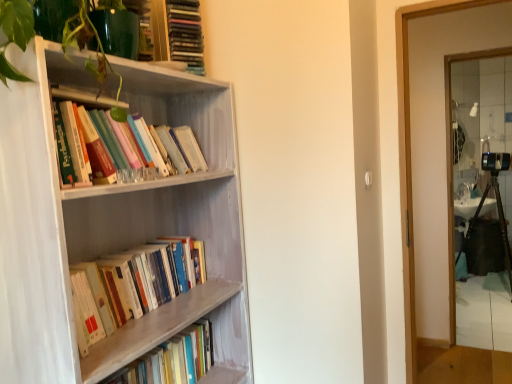
Question: Does wooden bookcase at left have a lesser height compared to clear glass mirror at right?

Choices:
 (A) yes
 (B) no

Answer: (A)

Question: From a real-world perspective, does wooden bookcase at left stand above clear glass mirror at right?

Choices:
 (A) no
 (B) yes

Answer: (B)

Question: Can you confirm if wooden bookcase at left is wider than clear glass mirror at right?

Choices:
 (A) no
 (B) yes

Answer: (B)

Question: Does wooden bookcase at left have a greater height compared to clear glass mirror at right?

Choices:
 (A) yes
 (B) no

Answer: (B)

Question: From the image's perspective, is wooden bookcase at left on top of clear glass mirror at right?

Choices:
 (A) yes
 (B) no

Answer: (B)

Question: Considering the positions of green glossy plant at upper left and wooden book at left, the 4th book viewed from the top, in the image, is green glossy plant at upper left taller or shorter than wooden book at left, the 4th book viewed from the top,?

Choices:
 (A) tall
 (B) short

Answer: (A)

Question: In the image, is green glossy plant at upper left positioned in front of or behind wooden book at left, the 4th book viewed from the top?

Choices:
 (A) behind
 (B) front

Answer: (B)

Question: From a real-world perspective, relative to wooden book at left, the 4th book viewed from the top, is green glossy plant at upper left vertically above or below?

Choices:
 (A) above
 (B) below

Answer: (A)

Question: From the image's perspective, is green glossy plant at upper left located above or below wooden book at left, which is the 1th book from bottom to top?

Choices:
 (A) below
 (B) above

Answer: (B)

Question: Based on their sizes in the image, would you say wooden book at left, which is the 1th book from bottom to top, is bigger or smaller than green glossy plant at upper left?

Choices:
 (A) small
 (B) big

Answer: (A)

Question: From the image's perspective, is wooden book at left, which is the 1th book from bottom to top, located above or below green glossy plant at upper left?

Choices:
 (A) above
 (B) below

Answer: (B)

Question: Is point (202, 354) positioned closer to the camera than point (119, 112)?

Choices:
 (A) closer
 (B) farther

Answer: (B)

Question: From a real-world perspective, is wooden book at left, which is the 1th book from bottom to top, above or below green glossy plant at upper left?

Choices:
 (A) above
 (B) below

Answer: (B)

Question: In the image, is clear glass mirror at right on the left side or the right side of matte plastic books at upper center, the 1th book viewed from the top?

Choices:
 (A) right
 (B) left

Answer: (A)

Question: Is point (455, 185) positioned closer to the camera than point (188, 18)?

Choices:
 (A) farther
 (B) closer

Answer: (A)